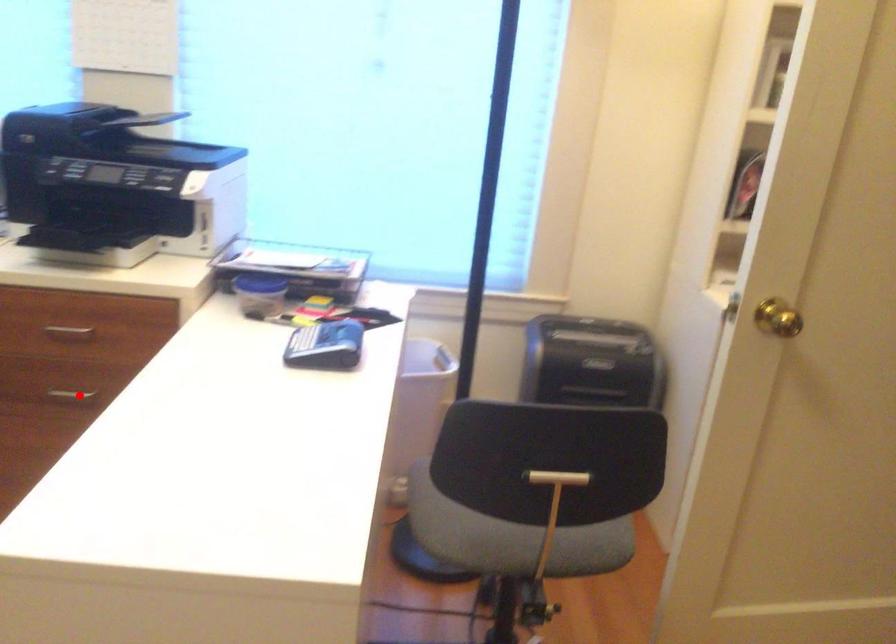
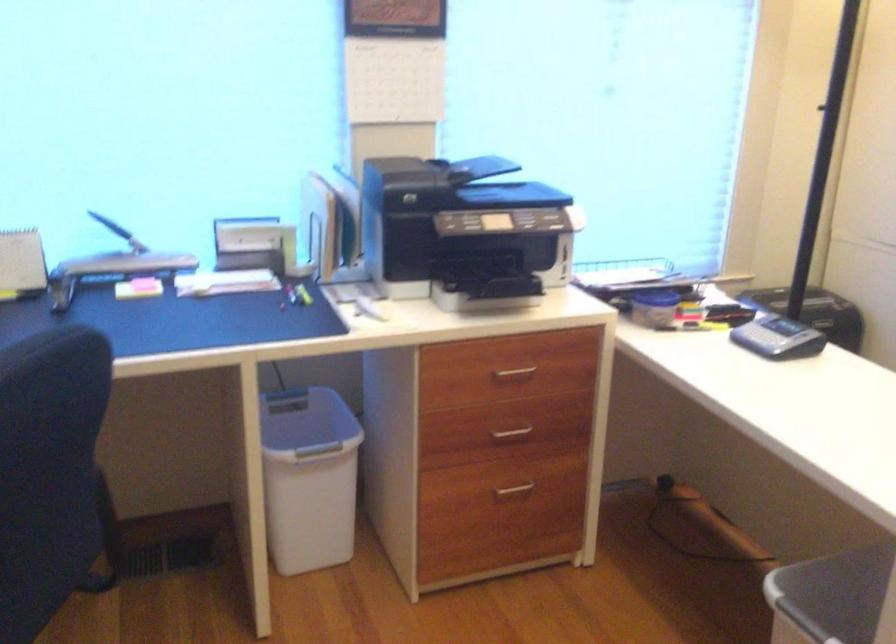
Find the pixel in the second image that matches the highlighted location in the first image.

(511, 433)